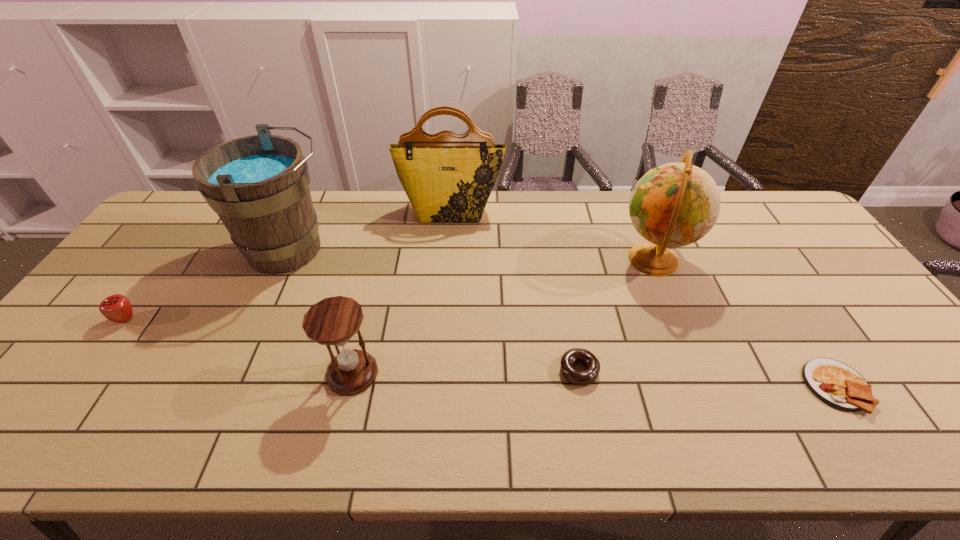
This screenshot has height=540, width=960. What are the coordinates of `tote bag` in the screenshot? It's located at click(448, 178).

I want to click on globe, so click(673, 205).

Identify the location of wine bucket. The image size is (960, 540). (258, 185).

The image size is (960, 540). Find the location of `hourglass`. hourglass is located at coordinates (332, 321).

This screenshot has width=960, height=540. In order to click on the leftmost object in this screenshot , I will do [117, 308].

This screenshot has height=540, width=960. What are the coordinates of `the fifth tallest object` in the screenshot? It's located at (117, 308).

What are the coordinates of `the third object from right to left` in the screenshot? It's located at (578, 377).

The width and height of the screenshot is (960, 540). Find the location of `doughnut`. doughnut is located at coordinates (578, 377).

Locate an element on the screen. omelet is located at coordinates (836, 384).

Image resolution: width=960 pixels, height=540 pixels. Identify the location of the shortest object. (836, 384).